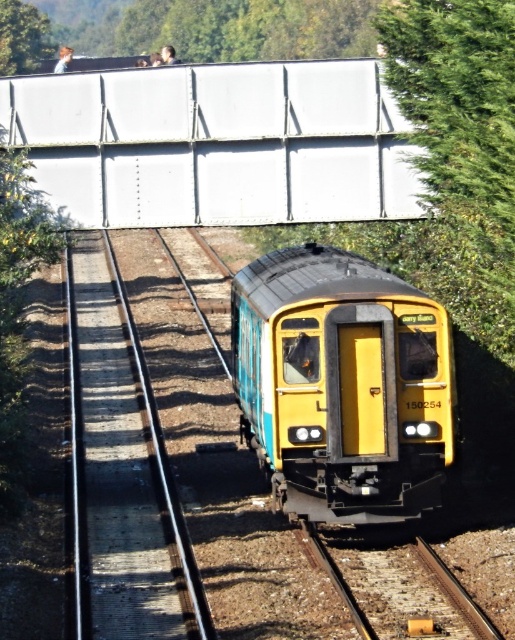
You are a passenger on the yellow train and want to look out the window to see the smooth concrete train track at center and the green leafy tree at upper left. Which object is closer to your eyes?

The smooth concrete train track at center is closer to your eyes because it is positioned below the green leafy tree at upper left, indicating it is nearer in the scene.